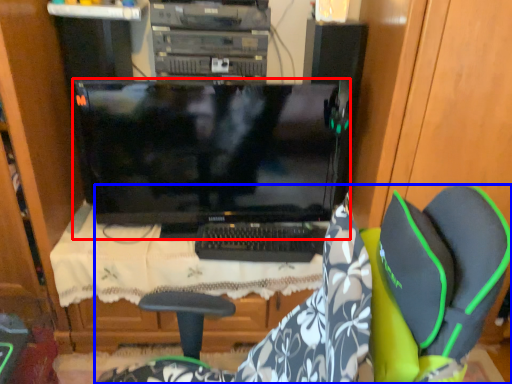
Question: Which point is further to the camera, computer monitor (highlighted by a red box) or chair (highlighted by a blue box)?

Choices:
 (A) computer monitor
 (B) chair

Answer: (A)